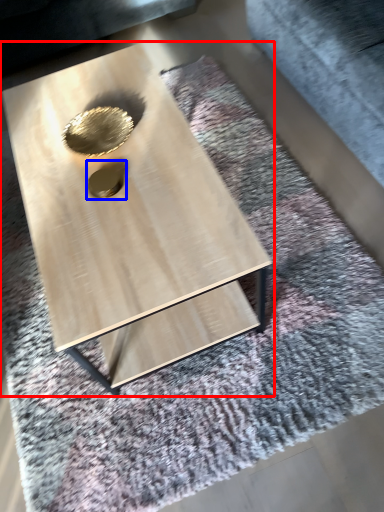
Question: Which point is closer to the camera, coffee table (highlighted by a red box) or hole (highlighted by a blue box)?

Choices:
 (A) coffee table
 (B) hole

Answer: (A)